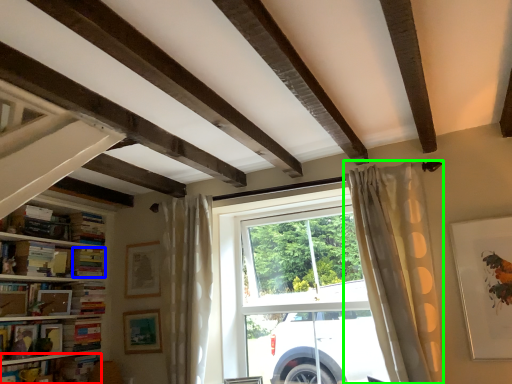
Question: Which object is positioned closest to book (highlighted by a red box)? Select from book (highlighted by a blue box) and curtain (highlighted by a green box).

Choices:
 (A) book
 (B) curtain

Answer: (A)